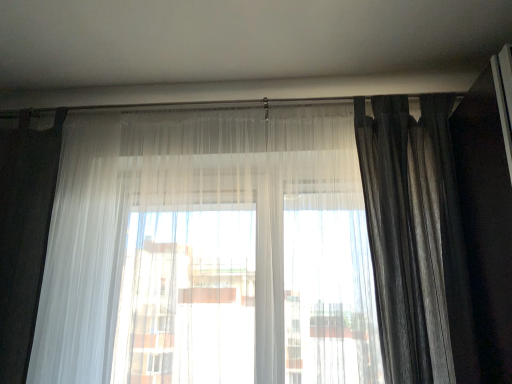
What do you see at coordinates (244, 248) in the screenshot? The image size is (512, 384). I see `sheer white curtain at center, which appears as the first curtain when viewed from the left` at bounding box center [244, 248].

Identify the location of sheer white curtain at center, which appears as the first curtain when viewed from the left. The height and width of the screenshot is (384, 512). (244, 248).

What is the approximate height of sheer white curtain at center, which ranks as the 2th curtain in right-to-left order?

The height of sheer white curtain at center, which ranks as the 2th curtain in right-to-left order, is 1.23 meters.

Describe the element at coordinates (410, 233) in the screenshot. I see `dark gray textured curtain at right, the 2th curtain positioned from the left` at that location.

What are the coordinates of `dark gray textured curtain at right, the 2th curtain positioned from the left` in the screenshot? It's located at coord(410,233).

Where is `sheer white curtain at center, which appears as the first curtain when viewed from the left`? This screenshot has width=512, height=384. sheer white curtain at center, which appears as the first curtain when viewed from the left is located at coordinates (244, 248).

Which object is positioned more to the right, dark gray textured curtain at right, the 2th curtain positioned from the left, or sheer white curtain at center, which ranks as the 2th curtain in right-to-left order?

dark gray textured curtain at right, the 2th curtain positioned from the left.

Is the depth of dark gray textured curtain at right, the 2th curtain positioned from the left, less than that of sheer white curtain at center, which ranks as the 2th curtain in right-to-left order?

No, the depth of dark gray textured curtain at right, the 2th curtain positioned from the left, is greater than that of sheer white curtain at center, which ranks as the 2th curtain in right-to-left order.

Which is behind, point (417, 154) or point (218, 364)?

Point (417, 154)

From the image's perspective, is dark gray textured curtain at right, which ranks as the first curtain in right-to-left order, over sheer white curtain at center, which appears as the first curtain when viewed from the left?

Yes, from the image's perspective, dark gray textured curtain at right, which ranks as the first curtain in right-to-left order, is over sheer white curtain at center, which appears as the first curtain when viewed from the left.

From a real-world perspective, between dark gray textured curtain at right, the 2th curtain positioned from the left, and sheer white curtain at center, which ranks as the 2th curtain in right-to-left order, who is vertically higher?

dark gray textured curtain at right, the 2th curtain positioned from the left.

Does dark gray textured curtain at right, which ranks as the first curtain in right-to-left order, have a greater width compared to sheer white curtain at center, which appears as the first curtain when viewed from the left?

Yes.

Is dark gray textured curtain at right, which ranks as the first curtain in right-to-left order, shorter than sheer white curtain at center, which ranks as the 2th curtain in right-to-left order?

A: Yes, dark gray textured curtain at right, which ranks as the first curtain in right-to-left order, is shorter than sheer white curtain at center, which ranks as the 2th curtain in right-to-left order.

Considering the relative sizes of dark gray textured curtain at right, the 2th curtain positioned from the left, and sheer white curtain at center, which appears as the first curtain when viewed from the left, in the image provided, is dark gray textured curtain at right, the 2th curtain positioned from the left, smaller than sheer white curtain at center, which appears as the first curtain when viewed from the left,?

Correct, dark gray textured curtain at right, the 2th curtain positioned from the left, occupies less space than sheer white curtain at center, which appears as the first curtain when viewed from the left.

Would you say dark gray textured curtain at right, which ranks as the first curtain in right-to-left order, is inside or outside sheer white curtain at center, which ranks as the 2th curtain in right-to-left order?

dark gray textured curtain at right, which ranks as the first curtain in right-to-left order, is outside sheer white curtain at center, which ranks as the 2th curtain in right-to-left order.

Can you see dark gray textured curtain at right, the 2th curtain positioned from the left, touching sheer white curtain at center, which appears as the first curtain when viewed from the left?

No.

Is dark gray textured curtain at right, the 2th curtain positioned from the left, positioned with its back to sheer white curtain at center, which appears as the first curtain when viewed from the left?

dark gray textured curtain at right, the 2th curtain positioned from the left, is not turned away from sheer white curtain at center, which appears as the first curtain when viewed from the left.

How different are the orientations of dark gray textured curtain at right, which ranks as the first curtain in right-to-left order, and sheer white curtain at center, which ranks as the 2th curtain in right-to-left order, in degrees?

dark gray textured curtain at right, which ranks as the first curtain in right-to-left order, and sheer white curtain at center, which ranks as the 2th curtain in right-to-left order, are facing 1.85 degrees away from each other.

The width and height of the screenshot is (512, 384). In order to click on curtain positioned vertically above the sheer white curtain at center, which appears as the first curtain when viewed from the left (from a real-world perspective) in this screenshot , I will do `click(410, 233)`.

Which is more to the right, sheer white curtain at center, which appears as the first curtain when viewed from the left, or dark gray textured curtain at right, the 2th curtain positioned from the left?

dark gray textured curtain at right, the 2th curtain positioned from the left, is more to the right.

Does sheer white curtain at center, which appears as the first curtain when viewed from the left, come behind dark gray textured curtain at right, which ranks as the first curtain in right-to-left order?

No, sheer white curtain at center, which appears as the first curtain when viewed from the left, is closer to the viewer.

Considering the points (145, 293) and (357, 106), which point is in front, point (145, 293) or point (357, 106)?

The point (145, 293) is more forward.

From the image's perspective, is sheer white curtain at center, which appears as the first curtain when viewed from the left, on top of dark gray textured curtain at right, the 2th curtain positioned from the left?

No, from the image's perspective, sheer white curtain at center, which appears as the first curtain when viewed from the left, is not above dark gray textured curtain at right, the 2th curtain positioned from the left.

From a real-world perspective, is sheer white curtain at center, which ranks as the 2th curtain in right-to-left order, above or below dark gray textured curtain at right, the 2th curtain positioned from the left?

sheer white curtain at center, which ranks as the 2th curtain in right-to-left order, is below dark gray textured curtain at right, the 2th curtain positioned from the left.

Is sheer white curtain at center, which appears as the first curtain when viewed from the left, thinner than dark gray textured curtain at right, the 2th curtain positioned from the left?

Yes.

Considering the relative sizes of sheer white curtain at center, which ranks as the 2th curtain in right-to-left order, and dark gray textured curtain at right, the 2th curtain positioned from the left, in the image provided, is sheer white curtain at center, which ranks as the 2th curtain in right-to-left order, taller than dark gray textured curtain at right, the 2th curtain positioned from the left,?

Correct, sheer white curtain at center, which ranks as the 2th curtain in right-to-left order, is much taller as dark gray textured curtain at right, the 2th curtain positioned from the left.

Does sheer white curtain at center, which ranks as the 2th curtain in right-to-left order, have a larger size compared to dark gray textured curtain at right, which ranks as the first curtain in right-to-left order?

Yes.

Which is correct: sheer white curtain at center, which appears as the first curtain when viewed from the left, is inside dark gray textured curtain at right, which ranks as the first curtain in right-to-left order, or outside of it?

sheer white curtain at center, which appears as the first curtain when viewed from the left, is spatially situated outside dark gray textured curtain at right, which ranks as the first curtain in right-to-left order.

Can you see sheer white curtain at center, which appears as the first curtain when viewed from the left, touching dark gray textured curtain at right, which ranks as the first curtain in right-to-left order?

No, sheer white curtain at center, which appears as the first curtain when viewed from the left, is not making contact with dark gray textured curtain at right, which ranks as the first curtain in right-to-left order.

Is sheer white curtain at center, which appears as the first curtain when viewed from the left, oriented away from dark gray textured curtain at right, the 2th curtain positioned from the left?

No, sheer white curtain at center, which appears as the first curtain when viewed from the left, is not facing the opposite direction of dark gray textured curtain at right, the 2th curtain positioned from the left.

You are a GUI agent. You are given a task and a screenshot of the screen. Output one action in this format:
    pyautogui.click(x=<x>, y=<y>)
    Task: Click on the curtain that appears on the right of sheer white curtain at center, which appears as the first curtain when viewed from the left
    
    Given the screenshot: What is the action you would take?
    pyautogui.click(x=410, y=233)

Find the location of `curtain above the sheer white curtain at center, which appears as the first curtain when viewed from the left (from a real-world perspective)`. curtain above the sheer white curtain at center, which appears as the first curtain when viewed from the left (from a real-world perspective) is located at coordinates (410, 233).

This screenshot has height=384, width=512. What are the coordinates of `curtain located on the right of sheer white curtain at center, which appears as the first curtain when viewed from the left` in the screenshot? It's located at click(410, 233).